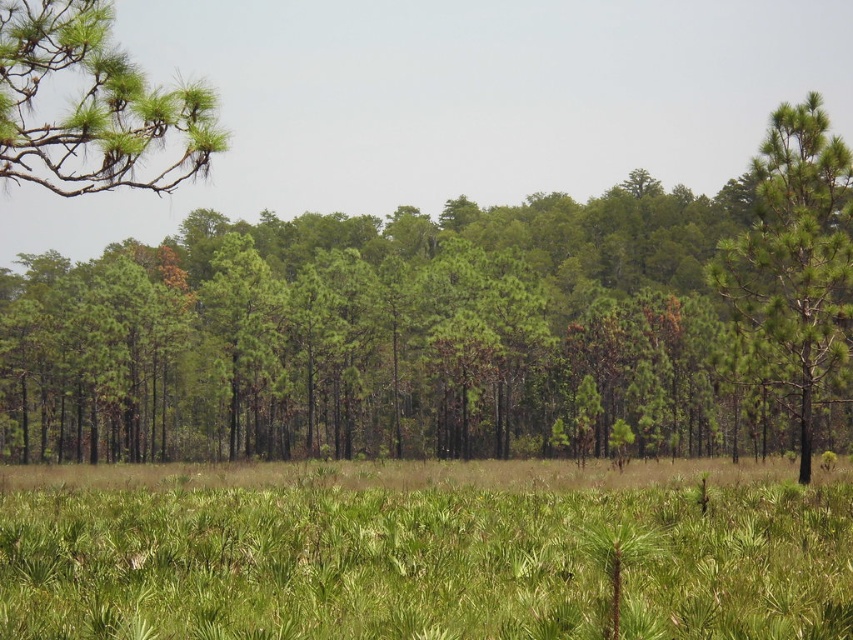
You are a hiker standing in the forest. You see a green leafy tree at center and a green leafy grass at center. Which one is positioned to the right?

The green leafy tree at center is positioned to the right of the green leafy grass at center.